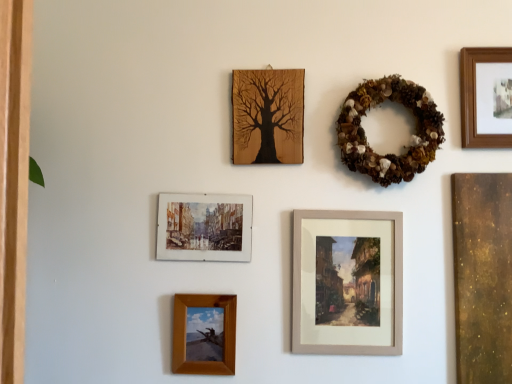
Question: Which direction should I rotate to look at wooden tree art at upper center, which is the third picture frame from left to right?

Choices:
 (A) right
 (B) left

Answer: (A)

Question: Considering the relative positions of wooden frame at lower center, which is the first picture frame in left-to-right order, and brown textured wreath at upper right in the image provided, is wooden frame at lower center, which is the first picture frame in left-to-right order, to the left of brown textured wreath at upper right from the viewer's perspective?

Choices:
 (A) yes
 (B) no

Answer: (A)

Question: Is wooden frame at lower center, which is the first picture frame in left-to-right order, in contact with brown textured wreath at upper right?

Choices:
 (A) yes
 (B) no

Answer: (B)

Question: From the image's perspective, is wooden frame at lower center, which is the first picture frame in left-to-right order, beneath brown textured wreath at upper right?

Choices:
 (A) no
 (B) yes

Answer: (B)

Question: Considering the relative positions of wooden frame at lower center, which appears as the 5th picture frame when viewed from the right, and brown textured wreath at upper right in the image provided, is wooden frame at lower center, which appears as the 5th picture frame when viewed from the right, to the right of brown textured wreath at upper right from the viewer's perspective?

Choices:
 (A) no
 (B) yes

Answer: (A)

Question: From the image's perspective, does wooden frame at lower center, which is the first picture frame in left-to-right order, appear higher than brown textured wreath at upper right?

Choices:
 (A) yes
 (B) no

Answer: (B)

Question: Does wooden frame at lower center, which is the first picture frame in left-to-right order, have a greater width compared to brown textured wreath at upper right?

Choices:
 (A) yes
 (B) no

Answer: (B)

Question: Does watercolor paper painting at upper left, the 2th picture frame when ordered from left to right, appear on the right side of wooden framed painting at center, placed as the 2th picture frame when sorted from right to left?

Choices:
 (A) no
 (B) yes

Answer: (A)

Question: Are watercolor paper painting at upper left, arranged as the fourth picture frame when viewed from the right, and wooden framed painting at center, the fourth picture frame in the left-to-right sequence, making contact?

Choices:
 (A) no
 (B) yes

Answer: (A)

Question: Is wooden framed painting at center, the fourth picture frame in the left-to-right sequence, located within watercolor paper painting at upper left, the 2th picture frame when ordered from left to right?

Choices:
 (A) yes
 (B) no

Answer: (B)

Question: Is the depth of watercolor paper painting at upper left, the 2th picture frame when ordered from left to right, greater than that of wooden framed painting at center, the fourth picture frame in the left-to-right sequence?

Choices:
 (A) yes
 (B) no

Answer: (A)

Question: Considering the relative sizes of watercolor paper painting at upper left, the 2th picture frame when ordered from left to right, and wooden framed painting at center, placed as the 2th picture frame when sorted from right to left, in the image provided, is watercolor paper painting at upper left, the 2th picture frame when ordered from left to right, smaller than wooden framed painting at center, placed as the 2th picture frame when sorted from right to left,?

Choices:
 (A) yes
 (B) no

Answer: (A)

Question: Is watercolor paper painting at upper left, the 2th picture frame when ordered from left to right, thinner than wooden framed painting at center, the fourth picture frame in the left-to-right sequence?

Choices:
 (A) yes
 (B) no

Answer: (A)

Question: Considering the relative sizes of watercolor paper painting at upper left, arranged as the fourth picture frame when viewed from the right, and wooden frame at lower center, which is the first picture frame in left-to-right order, in the image provided, is watercolor paper painting at upper left, arranged as the fourth picture frame when viewed from the right, smaller than wooden frame at lower center, which is the first picture frame in left-to-right order,?

Choices:
 (A) no
 (B) yes

Answer: (A)